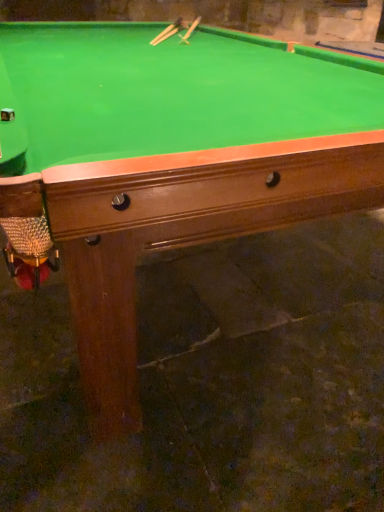
What is the approximate height of wooden cue at upper center, arranged as the 2th cue when viewed from the right?

wooden cue at upper center, arranged as the 2th cue when viewed from the right, is 4.05 centimeters tall.

What is the approximate width of wooden cue at upper center, arranged as the 2th cue when viewed from the right?

1.43 meters.

Where is `wooden cue at upper center, arranged as the first cue when viewed from the left`? The height and width of the screenshot is (512, 384). wooden cue at upper center, arranged as the first cue when viewed from the left is located at coordinates (166, 36).

What do you see at coordinates (166, 36) in the screenshot? I see `wooden cue at upper center, arranged as the 2th cue when viewed from the right` at bounding box center [166, 36].

The width and height of the screenshot is (384, 512). Describe the element at coordinates (190, 31) in the screenshot. I see `wooden cue at upper center, arranged as the second cue when viewed from the left` at that location.

At what (x,y) coordinates should I click in order to perform the action: click on wooden cue at upper center, which is the 1th cue from right to left. Please return your answer as a coordinate pair (x, y). This screenshot has height=512, width=384. Looking at the image, I should click on (190, 31).

Find the location of a particular element. This screenshot has height=512, width=384. wooden cue at upper center, arranged as the first cue when viewed from the left is located at coordinates (166, 36).

In the image, is wooden cue at upper center, arranged as the first cue when viewed from the left, on the left side or the right side of wooden cue at upper center, which is the 1th cue from right to left?

wooden cue at upper center, arranged as the first cue when viewed from the left, is to the left of wooden cue at upper center, which is the 1th cue from right to left.

Which object is closer to the camera taking this photo, wooden cue at upper center, arranged as the 2th cue when viewed from the right, or wooden cue at upper center, which is the 1th cue from right to left?

wooden cue at upper center, arranged as the 2th cue when viewed from the right.

Is point (172, 33) positioned after point (198, 22)?

No, it is not.

From the image's perspective, is wooden cue at upper center, arranged as the 2th cue when viewed from the right, on top of wooden cue at upper center, which is the 1th cue from right to left?

No, from the image's perspective, wooden cue at upper center, arranged as the 2th cue when viewed from the right, is not above wooden cue at upper center, which is the 1th cue from right to left.

From a real-world perspective, is wooden cue at upper center, arranged as the first cue when viewed from the left, below wooden cue at upper center, which is the 1th cue from right to left?

Yes, from a real-world perspective, wooden cue at upper center, arranged as the first cue when viewed from the left, is beneath wooden cue at upper center, which is the 1th cue from right to left.

Considering the sizes of objects wooden cue at upper center, arranged as the 2th cue when viewed from the right, and wooden cue at upper center, which is the 1th cue from right to left, in the image provided, who is thinner, wooden cue at upper center, arranged as the 2th cue when viewed from the right, or wooden cue at upper center, which is the 1th cue from right to left,?

With smaller width is wooden cue at upper center, arranged as the 2th cue when viewed from the right.

Is wooden cue at upper center, arranged as the 2th cue when viewed from the right, taller or shorter than wooden cue at upper center, arranged as the second cue when viewed from the left?

wooden cue at upper center, arranged as the 2th cue when viewed from the right, is shorter than wooden cue at upper center, arranged as the second cue when viewed from the left.

Based on their sizes in the image, would you say wooden cue at upper center, arranged as the first cue when viewed from the left, is bigger or smaller than wooden cue at upper center, which is the 1th cue from right to left?

Considering their sizes, wooden cue at upper center, arranged as the first cue when viewed from the left, takes up less space than wooden cue at upper center, which is the 1th cue from right to left.

Consider the image. Would you say wooden cue at upper center, arranged as the 2th cue when viewed from the right, is outside wooden cue at upper center, which is the 1th cue from right to left?

Yes, wooden cue at upper center, arranged as the 2th cue when viewed from the right, is outside of wooden cue at upper center, which is the 1th cue from right to left.

Is wooden cue at upper center, arranged as the first cue when viewed from the left, positioned far away from wooden cue at upper center, arranged as the second cue when viewed from the left?

wooden cue at upper center, arranged as the first cue when viewed from the left, is near wooden cue at upper center, arranged as the second cue when viewed from the left, not far away.

In the scene shown: Could you tell me if wooden cue at upper center, arranged as the 2th cue when viewed from the right, is turned towards wooden cue at upper center, arranged as the second cue when viewed from the left?

No, wooden cue at upper center, arranged as the 2th cue when viewed from the right, is not oriented towards wooden cue at upper center, arranged as the second cue when viewed from the left.

Can you tell me how much wooden cue at upper center, arranged as the 2th cue when viewed from the right, and wooden cue at upper center, arranged as the second cue when viewed from the left, differ in facing direction?

The facing directions of wooden cue at upper center, arranged as the 2th cue when viewed from the right, and wooden cue at upper center, arranged as the second cue when viewed from the left, are 2.21 degrees apart.

Find the location of a particular element. cue behind the wooden cue at upper center, arranged as the 2th cue when viewed from the right is located at coordinates (190, 31).

Visually, is wooden cue at upper center, which is the 1th cue from right to left, positioned to the left or to the right of wooden cue at upper center, arranged as the 2th cue when viewed from the right?

Clearly, wooden cue at upper center, which is the 1th cue from right to left, is on the right of wooden cue at upper center, arranged as the 2th cue when viewed from the right, in the image.

Is wooden cue at upper center, arranged as the second cue when viewed from the left, closer to camera compared to wooden cue at upper center, arranged as the 2th cue when viewed from the right?

No, it is behind wooden cue at upper center, arranged as the 2th cue when viewed from the right.

Is point (196, 22) more distant than point (177, 28)?

Yes, it is behind point (177, 28).

From the image's perspective, relative to wooden cue at upper center, arranged as the 2th cue when viewed from the right, is wooden cue at upper center, which is the 1th cue from right to left, above or below?

wooden cue at upper center, which is the 1th cue from right to left, is above wooden cue at upper center, arranged as the 2th cue when viewed from the right.

From a real-world perspective, is wooden cue at upper center, arranged as the second cue when viewed from the left, physically located above or below wooden cue at upper center, arranged as the 2th cue when viewed from the right?

From a real-world perspective, wooden cue at upper center, arranged as the second cue when viewed from the left, is physically above wooden cue at upper center, arranged as the 2th cue when viewed from the right.

Which object is wider, wooden cue at upper center, arranged as the second cue when viewed from the left, or wooden cue at upper center, arranged as the 2th cue when viewed from the right?

wooden cue at upper center, arranged as the second cue when viewed from the left.

Which of these two, wooden cue at upper center, arranged as the second cue when viewed from the left, or wooden cue at upper center, arranged as the first cue when viewed from the left, stands shorter?

wooden cue at upper center, arranged as the first cue when viewed from the left, is shorter.

Is wooden cue at upper center, which is the 1th cue from right to left, smaller than wooden cue at upper center, arranged as the first cue when viewed from the left?

No.

Do you think wooden cue at upper center, which is the 1th cue from right to left, is within wooden cue at upper center, arranged as the 2th cue when viewed from the right, or outside of it?

wooden cue at upper center, which is the 1th cue from right to left, is located beyond the bounds of wooden cue at upper center, arranged as the 2th cue when viewed from the right.

Is wooden cue at upper center, which is the 1th cue from right to left, beside wooden cue at upper center, arranged as the first cue when viewed from the left?

No, wooden cue at upper center, which is the 1th cue from right to left, is not beside wooden cue at upper center, arranged as the first cue when viewed from the left.

Could you tell me if wooden cue at upper center, arranged as the second cue when viewed from the left, is turned towards wooden cue at upper center, arranged as the first cue when viewed from the left?

No, wooden cue at upper center, arranged as the second cue when viewed from the left, is not oriented towards wooden cue at upper center, arranged as the first cue when viewed from the left.

Can you tell me how much wooden cue at upper center, which is the 1th cue from right to left, and wooden cue at upper center, arranged as the 2th cue when viewed from the right, differ in facing direction?

The facing directions of wooden cue at upper center, which is the 1th cue from right to left, and wooden cue at upper center, arranged as the 2th cue when viewed from the right, are 2.21 degrees apart.

Where is `cue on the left of wooden cue at upper center, which is the 1th cue from right to left`? This screenshot has height=512, width=384. cue on the left of wooden cue at upper center, which is the 1th cue from right to left is located at coordinates (166, 36).

Where is `cue on the left of the wooden cue at upper center, which is the 1th cue from right to left`? cue on the left of the wooden cue at upper center, which is the 1th cue from right to left is located at coordinates (166, 36).

I want to click on cue that is on the right side of wooden cue at upper center, arranged as the 2th cue when viewed from the right, so click(190, 31).